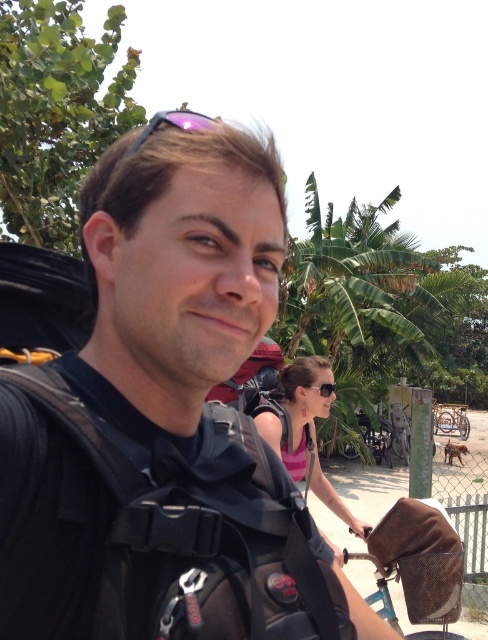
Question: Is black backpack at center thinner than pink fabric top at center?

Choices:
 (A) yes
 (B) no

Answer: (B)

Question: Which object is positioned farthest from the black backpack at center?

Choices:
 (A) purple reflective sunglasses at upper center
 (B) pink fabric top at center

Answer: (B)

Question: Which object appears closest to the camera in this image?

Choices:
 (A) purple reflective sunglasses at upper center
 (B) pink fabric top at center

Answer: (A)

Question: Can you confirm if black backpack at center is positioned above pink fabric top at center?

Choices:
 (A) no
 (B) yes

Answer: (B)

Question: Can you confirm if black backpack at center is thinner than pink fabric top at center?

Choices:
 (A) no
 (B) yes

Answer: (A)

Question: Which of the following is the farthest from the observer?

Choices:
 (A) black backpack at center
 (B) pink fabric top at center
 (C) purple reflective sunglasses at upper center

Answer: (B)